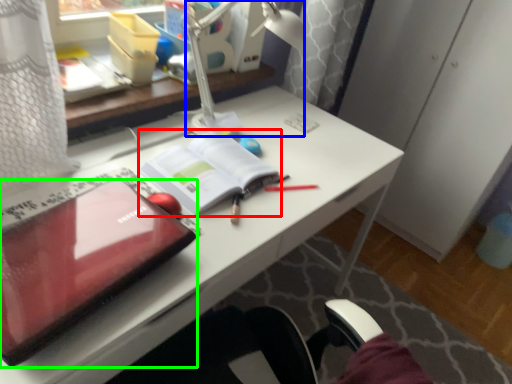
Question: Which is farther away from paperback book (highlighted by a red box)? lamp (highlighted by a blue box) or laptop (highlighted by a green box)?

Choices:
 (A) lamp
 (B) laptop

Answer: (B)